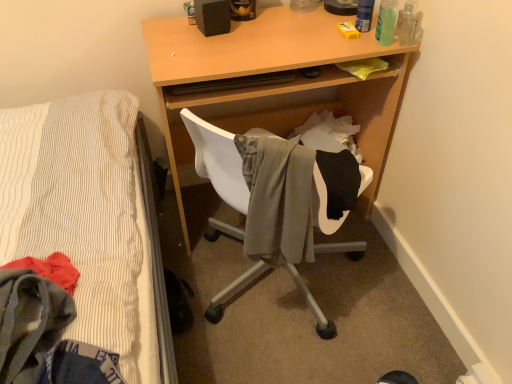
Where is `unoccupied space behind green translucent bottle at upper right, which is the second bottle from left to right`? The image size is (512, 384). unoccupied space behind green translucent bottle at upper right, which is the second bottle from left to right is located at coordinates (371, 24).